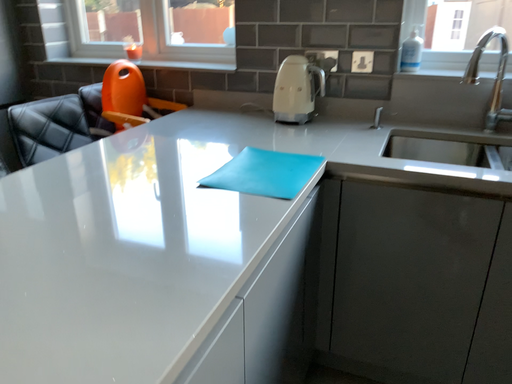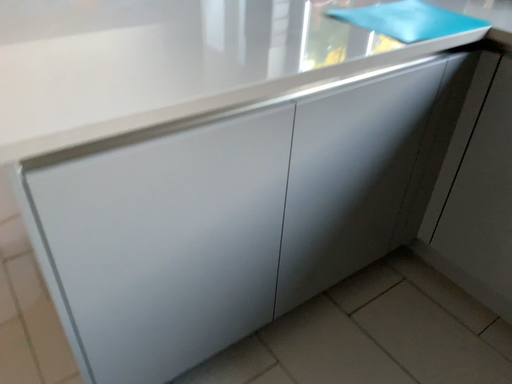
Question: Which way did the camera rotate in the video?

Choices:
 (A) rotated right
 (B) rotated left

Answer: (B)